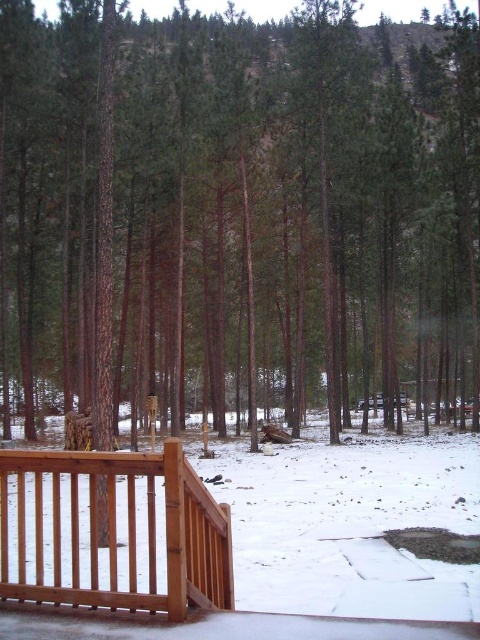
You are standing on the wooden deck and want to walk towards the brown wooden porch at lower left. Which direction should you move relative to the wooden railing at lower left?

You should move to the right side of the wooden railing at lower left to reach the brown wooden porch at lower left since it is positioned on the right side of the wooden railing at lower left.

You are standing on the wooden deck and looking out. You see two points marked in the scene. Which point, point (x=192, y=298) or point (x=414, y=636), is closer to you?

Point (x=192, y=298) is further to the camera than point (x=414, y=636), so the point closer to you is point (x=414, y=636).